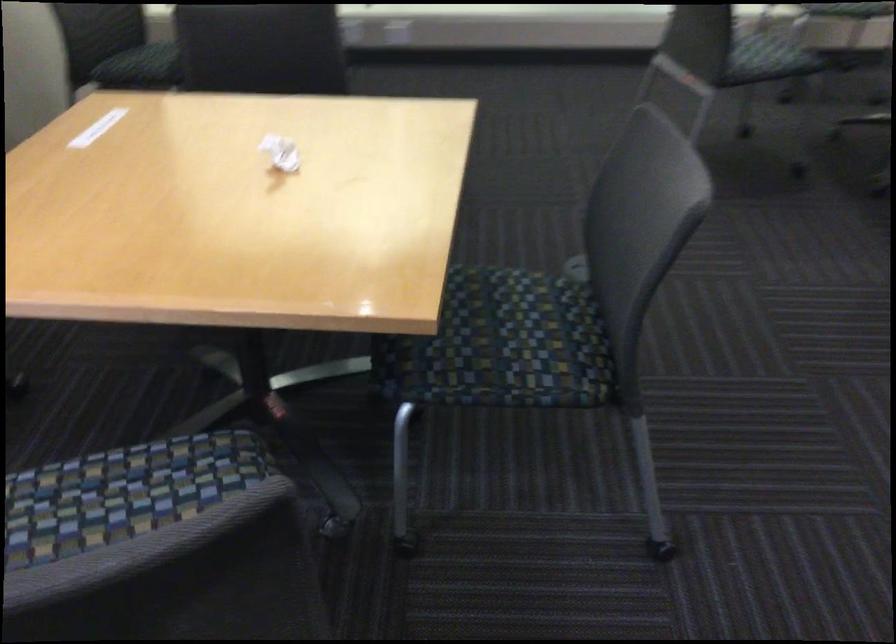
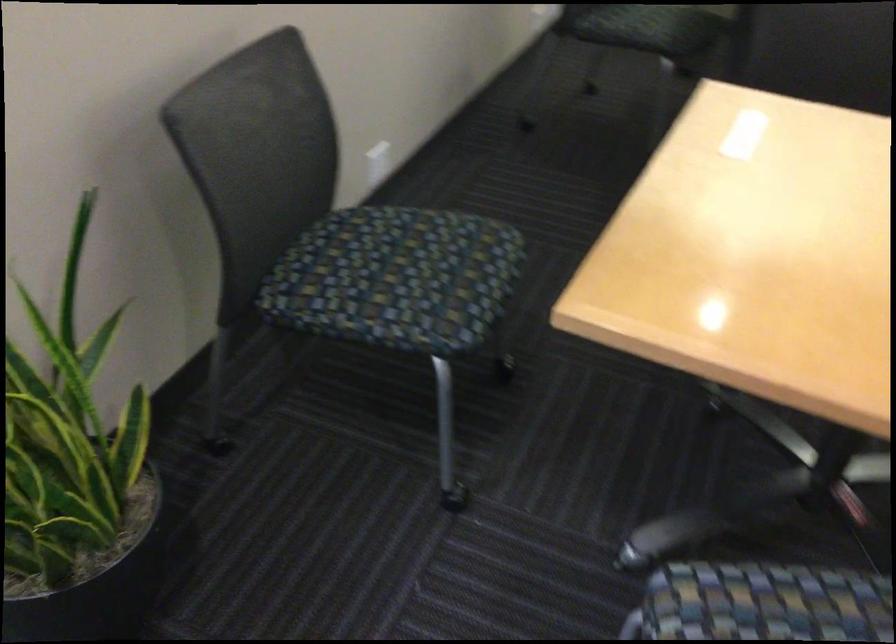
Question: Which direction would the cameraman need to move to produce the second image? Reply with the corresponding letter.

Choices:
 (A) Left
 (B) Right
 (C) Forward
 (D) Backward

Answer: (A)